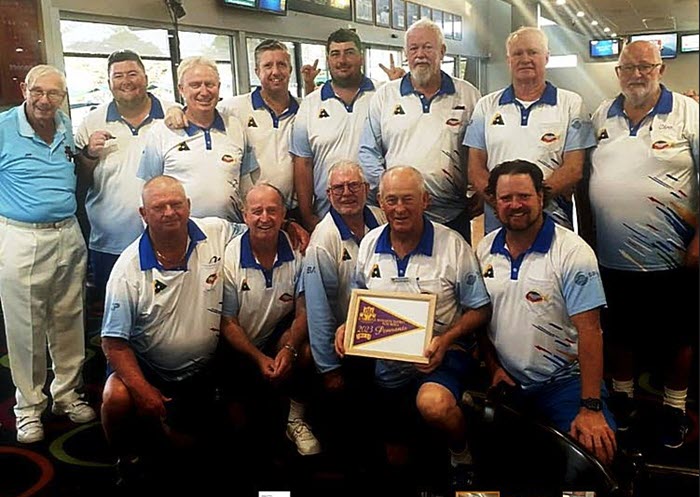
This screenshot has width=700, height=497. I want to click on floor, so click(71, 442).